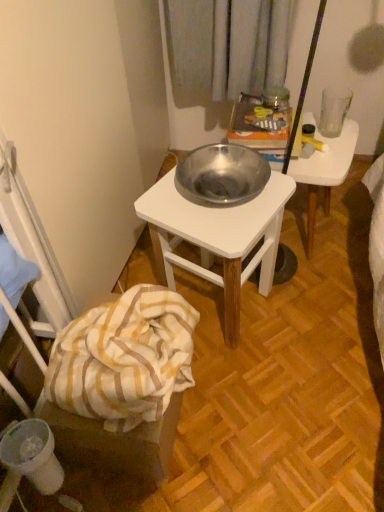
The width and height of the screenshot is (384, 512). I want to click on free point above metallic silver bowl at center (from a real-world perspective), so click(322, 148).